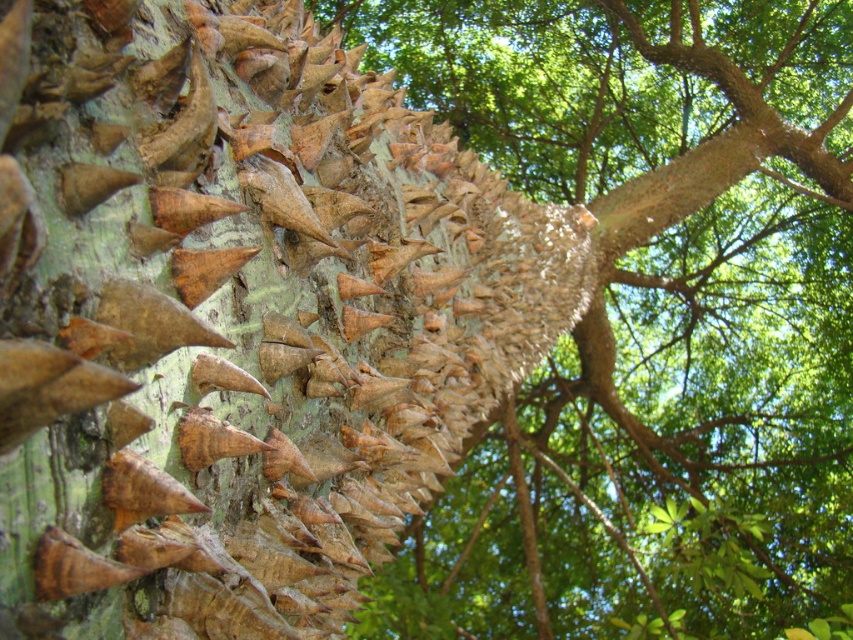
You are an arborist examining a tree trunk. You notice two sections of bark labeled as green rough bark at center and brown rough bark at center. Which section is positioned lower on the tree trunk?

The green rough bark at center is positioned lower than the brown rough bark at center, as it is located below it on the trunk.

You are an arborist examining a tree trunk. You notice two sections of bark, the green rough bark at center and the brown rough bark at center. Which section is closer to the ground?

The green rough bark at center is shorter than the brown rough bark at center, so the green rough bark at center is closer to the ground.

In the scene shown: You are standing 2 meters away from a tree trunk covered in spines. You notice a specific point marked at coordinates point (148, 474). Can you reach this point with your hand without moving closer than 1.94 meters?

The point (148, 474) is 1.94 meters from the viewer. Since you are standing 2 meters away, which is slightly farther than 1.94 meters, you cannot reach it without moving closer.